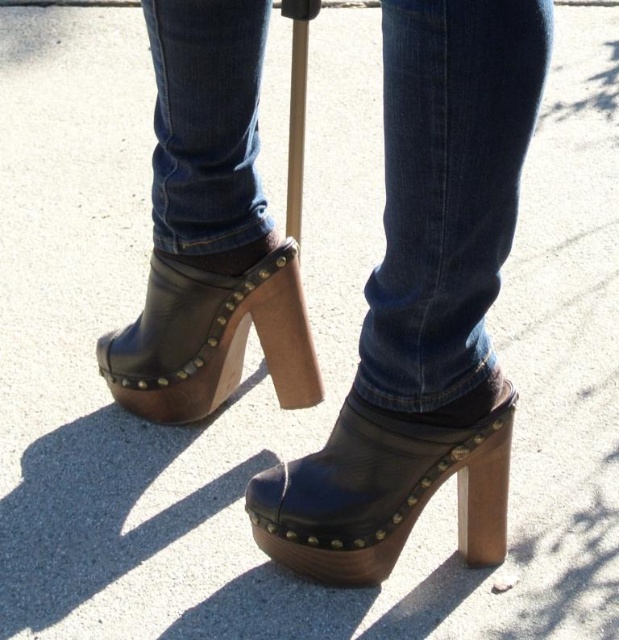
Question: Which point is farther from the camera taking this photo?

Choices:
 (A) (329, 554)
 (B) (410, 68)

Answer: (A)

Question: Does denim at center have a lesser width compared to leather studded clog at center?

Choices:
 (A) no
 (B) yes

Answer: (B)

Question: Among these objects, which one is farthest from the camera?

Choices:
 (A) leather studded clog at center
 (B) black leather clog at center

Answer: (A)

Question: Can you confirm if denim at center is thinner than leather studded clog at center?

Choices:
 (A) no
 (B) yes

Answer: (B)

Question: Can you confirm if black leather clog at center is positioned to the left of leather studded clog at center?

Choices:
 (A) no
 (B) yes

Answer: (A)

Question: Based on their relative distances, which object is nearer to the black leather clog at center?

Choices:
 (A) leather studded clog at center
 (B) denim at center

Answer: (B)